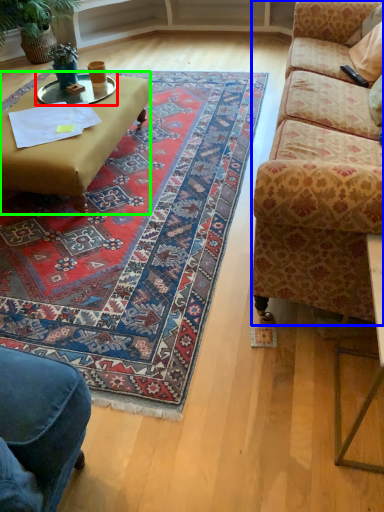
Question: Based on their relative distances, which object is nearer to glass table (highlighted by a red box)? Choose from studio couch (highlighted by a blue box) and coffee table (highlighted by a green box).

Choices:
 (A) studio couch
 (B) coffee table

Answer: (B)